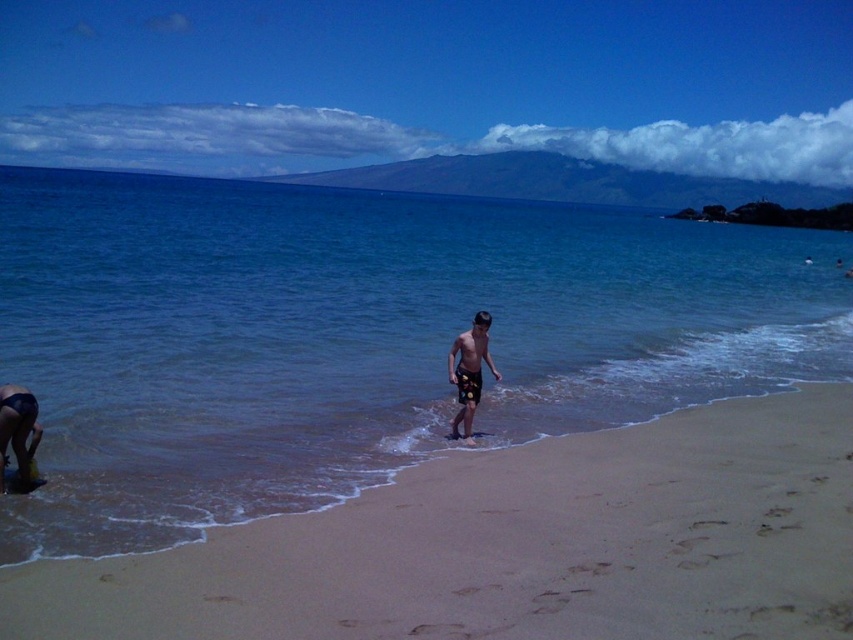
Can you confirm if clear blue water at center is shorter than sandy beach at center?

Incorrect, clear blue water at center's height does not fall short of sandy beach at center's.

Is clear blue water at center to the right of sandy beach at center from the viewer's perspective?

In fact, clear blue water at center is to the left of sandy beach at center.

The height and width of the screenshot is (640, 853). I want to click on clear blue water at center, so click(357, 337).

In order to click on clear blue water at center in this screenshot , I will do `click(357, 337)`.

Between sandy beach at center and multicolored swim trunks at center, which one has more height?

With more height is multicolored swim trunks at center.

I want to click on sandy beach at center, so tap(515, 545).

Between point (701, 456) and point (486, 346), which one is positioned behind?

Point (486, 346)

This screenshot has height=640, width=853. What are the coordinates of `sandy beach at center` in the screenshot? It's located at (515, 545).

Is clear blue water at center shorter than multicolored swim trunks at center?

No, clear blue water at center is not shorter than multicolored swim trunks at center.

Which of these two, clear blue water at center or multicolored swim trunks at center, stands taller?

With more height is clear blue water at center.

Measure the distance between clear blue water at center and camera.

clear blue water at center is 6.81 meters away from camera.

You are a GUI agent. You are given a task and a screenshot of the screen. Output one action in this format:
    pyautogui.click(x=<x>, y=<y>)
    Task: Click on the clear blue water at center
    
    Given the screenshot: What is the action you would take?
    pyautogui.click(x=357, y=337)